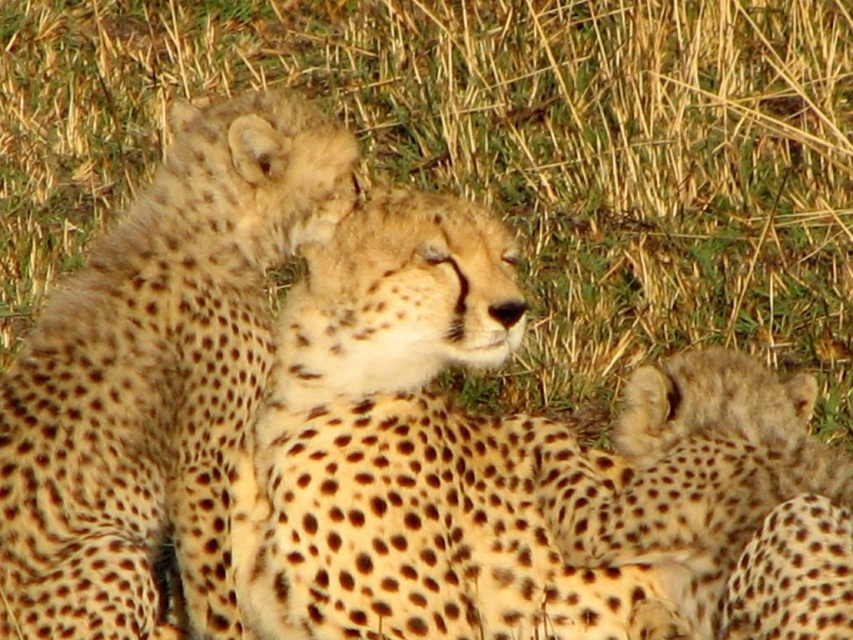
You are observing two points in the image of the resting cheetahs. Point A is at coordinates point (408, 305) and Point B is at point (125, 314). Which point is closer to you?

Point A at point (408, 305) is closer to the viewer than point B at point (125, 314).

You are a wildlife photographer aiming to capture a clear shot of the spotted fur cheetah cub at upper center. However, there is yellowish grass at center blocking your view. Based on their positions, can you determine if the grass is in front of or behind the cub?

The yellowish grass at center is located above the spotted fur cheetah cub at upper center, meaning the grass is blocking the view from above the cub. Since the grass is above, it is in front of the cub from your perspective, so you would need to adjust your angle to avoid the obstruction.